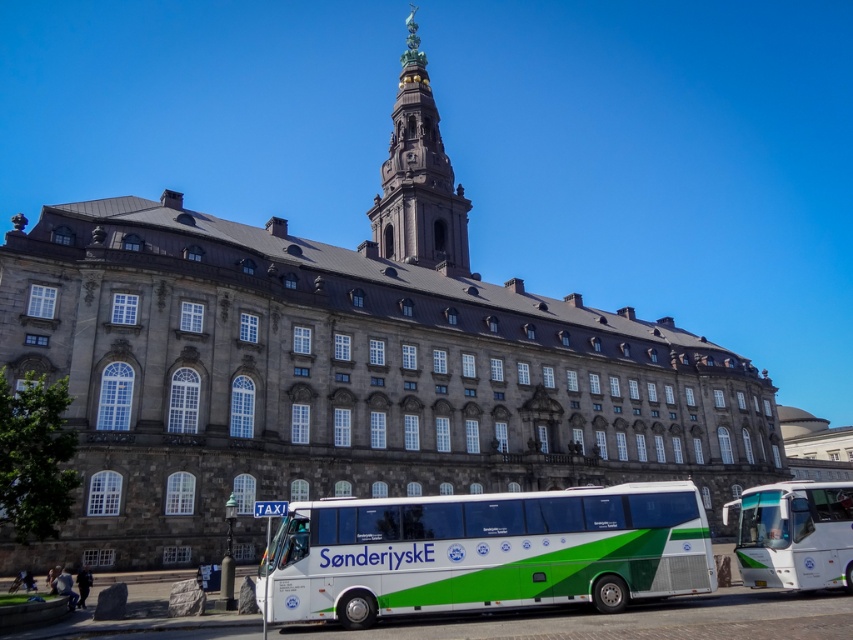
How distant is white/green painted bus at lower center from white glossy bus at right?

white/green painted bus at lower center is 11.67 meters away from white glossy bus at right.

Can you confirm if white/green painted bus at lower center is smaller than white glossy bus at right?

No, white/green painted bus at lower center is not smaller than white glossy bus at right.

The width and height of the screenshot is (853, 640). Describe the element at coordinates (485, 552) in the screenshot. I see `white/green painted bus at lower center` at that location.

Image resolution: width=853 pixels, height=640 pixels. I want to click on white/green painted bus at lower center, so click(485, 552).

Is white/green painted bus at lower center taller than dark gray stone tower at upper center?

No.

Is white/green painted bus at lower center to the right of dark gray stone tower at upper center from the viewer's perspective?

Correct, you'll find white/green painted bus at lower center to the right of dark gray stone tower at upper center.

Is point (543, 586) closer to camera compared to point (399, 125)?

Yes, it is.

Where is `white/green painted bus at lower center`? The height and width of the screenshot is (640, 853). white/green painted bus at lower center is located at coordinates (485, 552).

Does dark gray stone tower at upper center lie behind white glossy bus at right?

That is True.

What do you see at coordinates (418, 179) in the screenshot? I see `dark gray stone tower at upper center` at bounding box center [418, 179].

Where is `dark gray stone tower at upper center`? This screenshot has width=853, height=640. dark gray stone tower at upper center is located at coordinates (418, 179).